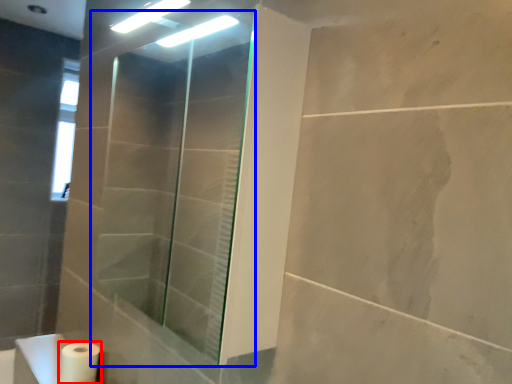
Question: Which point is further to the camera, toilet paper (highlighted by a red box) or shower door (highlighted by a blue box)?

Choices:
 (A) toilet paper
 (B) shower door

Answer: (A)